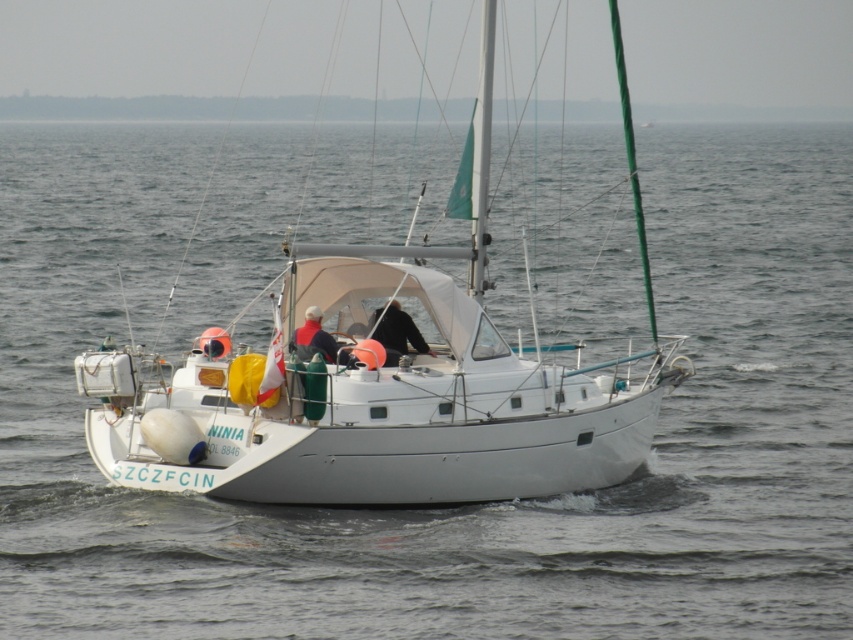
Question: Which of the following is the farthest from the observer?

Choices:
 (A) white matte jacket at center
 (B) white matte sailboat at center

Answer: (A)

Question: Does black fabric jacket at center have a greater width compared to white matte jacket at center?

Choices:
 (A) yes
 (B) no

Answer: (A)

Question: Which point is closer to the camera?

Choices:
 (A) (372, 324)
 (B) (592, 392)

Answer: (A)

Question: Is white matte sailboat at center above black fabric jacket at center?

Choices:
 (A) no
 (B) yes

Answer: (B)

Question: Is white matte sailboat at center further to camera compared to white matte jacket at center?

Choices:
 (A) yes
 (B) no

Answer: (B)

Question: Which point appears closest to the camera in this image?

Choices:
 (A) (390, 349)
 (B) (318, 310)

Answer: (A)